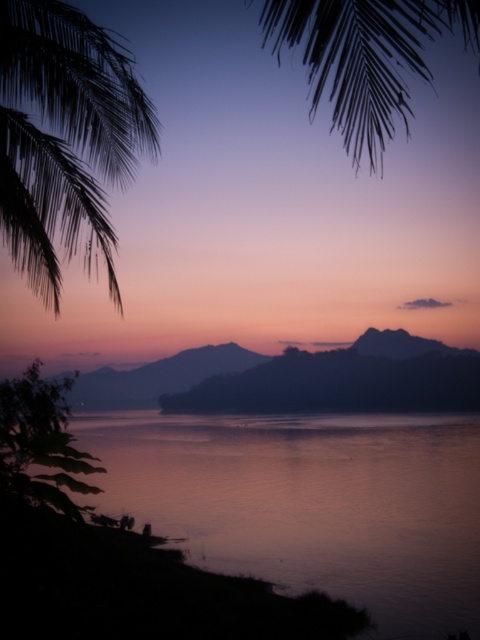
Question: Can you confirm if smooth water at lower center is bigger than silky black palm leaf at upper center?

Choices:
 (A) yes
 (B) no

Answer: (B)

Question: Based on their relative distances, which object is nearer to the silky black palm fronds at upper left?

Choices:
 (A) smooth water at lower center
 (B) silky black palm leaf at upper center

Answer: (B)

Question: Can you confirm if smooth water at lower center is positioned to the right of silky black palm leaf at upper center?

Choices:
 (A) no
 (B) yes

Answer: (A)

Question: Which point is closer to the camera?

Choices:
 (A) silky black palm leaf at upper center
 (B) smooth water at lower center

Answer: (A)

Question: Is smooth water at lower center to the left of silky black palm leaf at upper center from the viewer's perspective?

Choices:
 (A) no
 (B) yes

Answer: (B)

Question: Which point is closer to the camera?

Choices:
 (A) (298, 513)
 (B) (399, 65)
 (C) (88, 70)

Answer: (C)